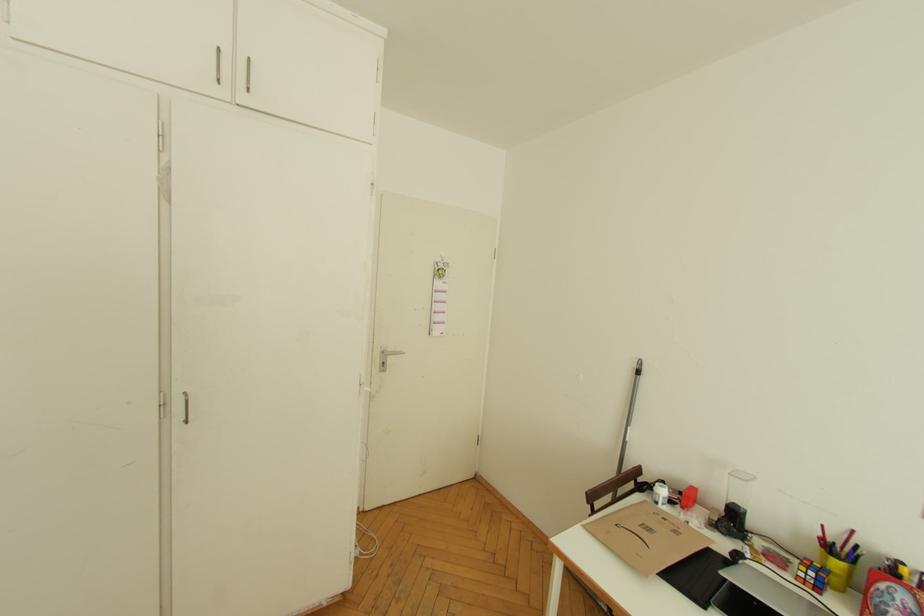
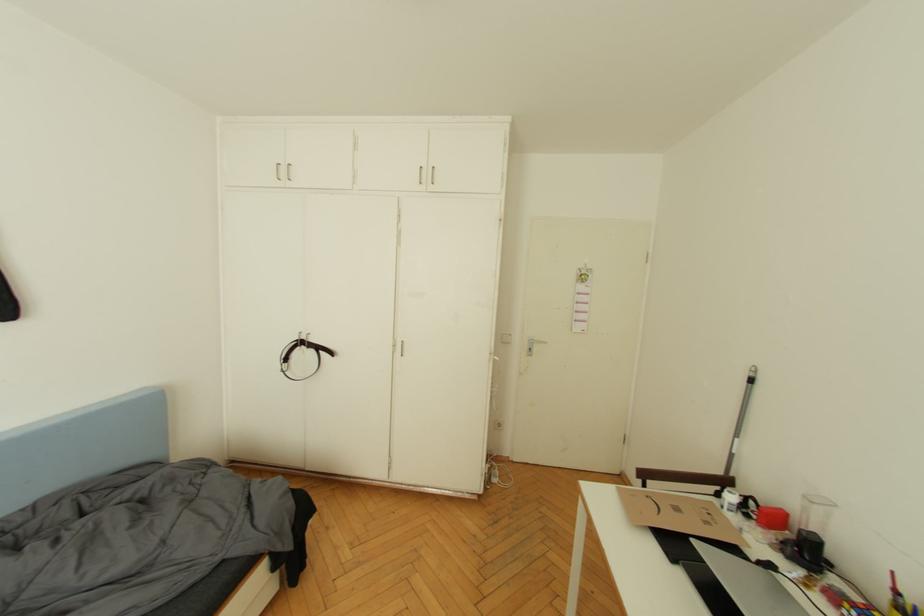
Question: The first image is from the beginning of the video and the second image is from the end. How did the camera likely rotate when shooting the video?

Choices:
 (A) Left
 (B) Right
 (C) Up
 (D) Down

Answer: (A)